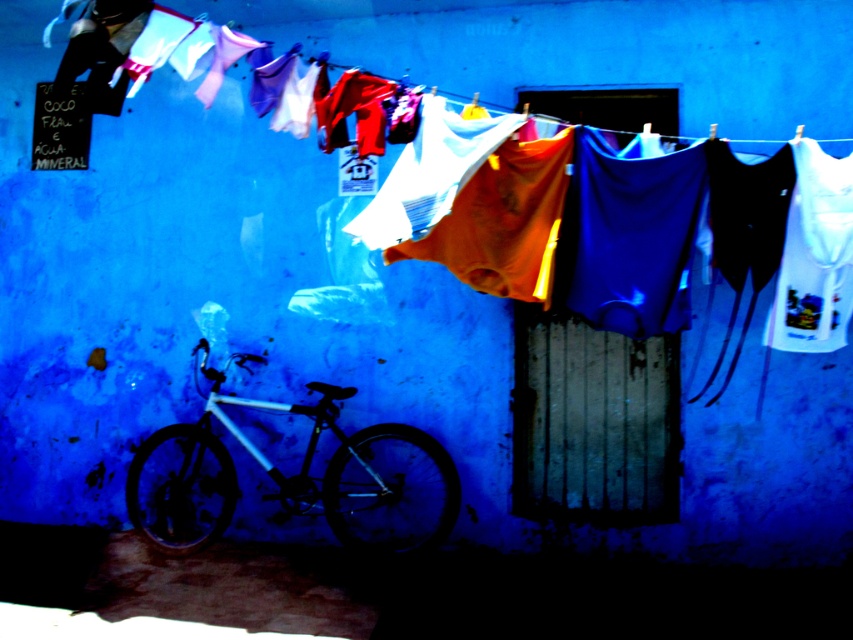
Where is the orange fabric at center located in the image?

The orange fabric at center is located at point (212,273) in the image.

You are standing in front of the deep blue wall with the laundry line. There is a bicycle leaning against the wall. If you walk straight towards the point marked at coordinates (x=212, y=273), which object will you first encounter?

The point at (x=212, y=273) is on the orange fabric at center, so you will first encounter the orange fabric at center before reaching the bicycle or the wall.

You are an interior designer assessing the laundry setup. The orange fabric at center and the matte fabric clothesline at upper center are both part of the design. Which object has a greater width?

The orange fabric at center has a greater width than the matte fabric clothesline at upper center.